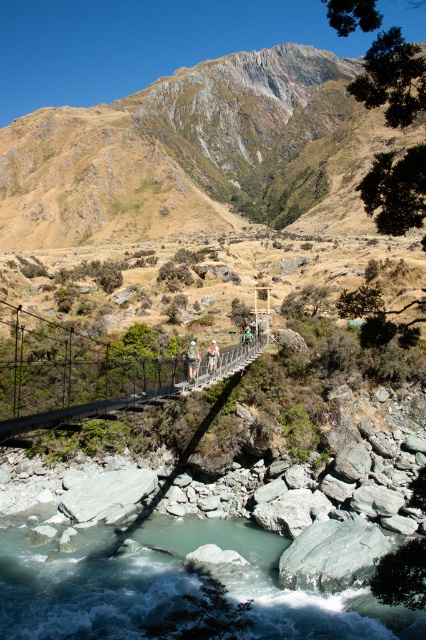
Is rugged brown rock at upper center to the left of light brown fabric jacket at center from the viewer's perspective?

In fact, rugged brown rock at upper center is to the right of light brown fabric jacket at center.

Does rugged brown rock at upper center appear over light brown fabric jacket at center?

Yes, rugged brown rock at upper center is above light brown fabric jacket at center.

Which is behind, point (189, 224) or point (193, 356)?

The point (189, 224) is behind.

This screenshot has height=640, width=426. I want to click on rugged brown rock at upper center, so click(x=193, y=150).

Which is behind, point (319, 83) or point (138, 362)?

Positioned behind is point (319, 83).

Who is more forward, (353, 157) or (97, 380)?

Point (97, 380) is more forward.

You are a GUI agent. You are given a task and a screenshot of the screen. Output one action in this format:
    pyautogui.click(x=<x>, y=<y>)
    Task: Click on the rugged brown rock at upper center
    The height and width of the screenshot is (640, 426).
    Given the screenshot: What is the action you would take?
    pyautogui.click(x=193, y=150)

Based on the photo, does white fabric person at center have a lesser height compared to green fabric person at center?

Yes, white fabric person at center is shorter than green fabric person at center.

Is white fabric person at center in front of green fabric person at center?

Yes, white fabric person at center is closer to the viewer.

Which is behind, point (218, 349) or point (247, 348)?

Point (218, 349)

Locate an element on the screen. The height and width of the screenshot is (640, 426). white fabric person at center is located at coordinates (213, 356).